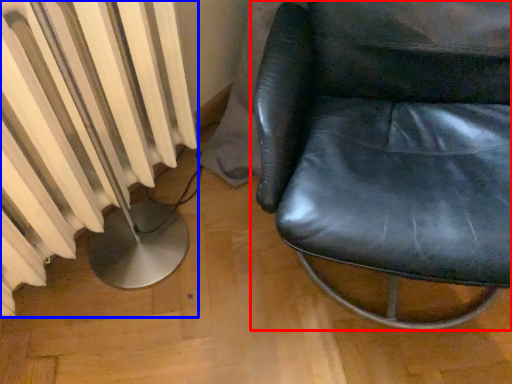
Question: Among these objects, which one is nearest to the camera, chair (highlighted by a red box) or radiator (highlighted by a blue box)?

Choices:
 (A) chair
 (B) radiator

Answer: (A)